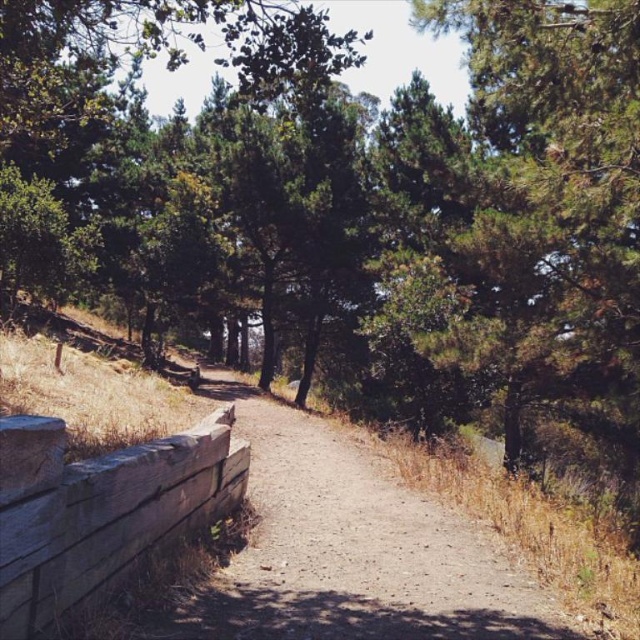
You are a hiker carrying a map and compass. You need to decide whether to follow the dirt path at center or the weathered wood at lower left. Based on their sizes, which one is more likely to be a proper trail for hiking?

The dirt path at center is larger in size than the weathered wood at lower left, so the dirt path at center is more likely to be a proper trail for hiking since it is bigger and more suitable for hikers.